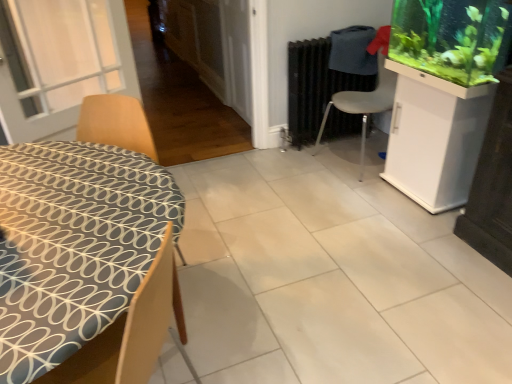
Question: Would you say green matte aquarium at upper right is part of black matte radiator at center's contents?

Choices:
 (A) yes
 (B) no

Answer: (B)

Question: Does black matte radiator at center have a lesser height compared to green matte aquarium at upper right?

Choices:
 (A) yes
 (B) no

Answer: (B)

Question: Is black matte radiator at center positioned behind green matte aquarium at upper right?

Choices:
 (A) no
 (B) yes

Answer: (B)

Question: Could you tell me if black matte radiator at center is turned towards green matte aquarium at upper right?

Choices:
 (A) yes
 (B) no

Answer: (A)

Question: From a real-world perspective, is black matte radiator at center under green matte aquarium at upper right?

Choices:
 (A) no
 (B) yes

Answer: (B)

Question: Is black matte radiator at center bigger or smaller than white glossy cabinet at right?

Choices:
 (A) small
 (B) big

Answer: (A)

Question: From their relative heights in the image, would you say black matte radiator at center is taller or shorter than white glossy cabinet at right?

Choices:
 (A) short
 (B) tall

Answer: (B)

Question: From the image's perspective, is black matte radiator at center above or below white glossy cabinet at right?

Choices:
 (A) above
 (B) below

Answer: (A)

Question: In terms of width, does black matte radiator at center look wider or thinner when compared to white glossy cabinet at right?

Choices:
 (A) thin
 (B) wide

Answer: (A)

Question: From a real-world perspective, relative to white plastic chair at center-right, the 2th chair viewed from the front, is white glossy tile at center vertically above or below?

Choices:
 (A) below
 (B) above

Answer: (A)

Question: Is white glossy tile at center spatially inside white plastic chair at center-right, placed as the second chair when sorted from left to right, or outside of it?

Choices:
 (A) inside
 (B) outside

Answer: (B)

Question: Based on their sizes in the image, would you say white glossy tile at center is bigger or smaller than white plastic chair at center-right, placed as the second chair when sorted from left to right?

Choices:
 (A) big
 (B) small

Answer: (B)

Question: From the image's perspective, is white glossy tile at center above or below white plastic chair at center-right, the 1th chair viewed from the back?

Choices:
 (A) below
 (B) above

Answer: (A)

Question: In the image, is black matte radiator at center positioned in front of or behind white plastic chair at center-right, the 1th chair viewed from the back?

Choices:
 (A) front
 (B) behind

Answer: (B)

Question: Considering the positions of point (353, 117) and point (364, 124), is point (353, 117) closer or farther from the camera than point (364, 124)?

Choices:
 (A) farther
 (B) closer

Answer: (A)